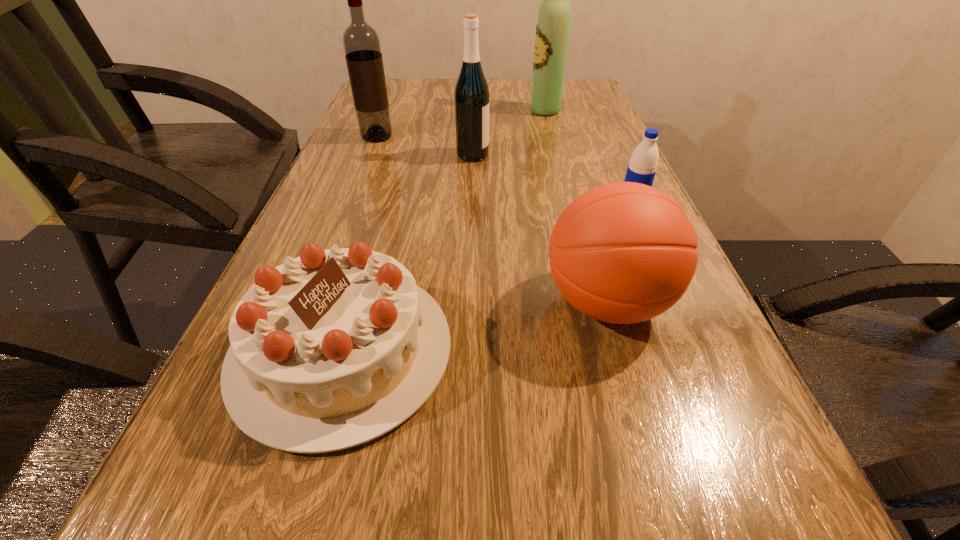
Find the location of a particular element. The image size is (960, 540). the farthest object is located at coordinates (553, 25).

The width and height of the screenshot is (960, 540). Find the location of `the farthest wine bottle`. the farthest wine bottle is located at coordinates (553, 25).

Identify the location of the leftmost wine bottle. (361, 43).

Locate an element on the screen. This screenshot has height=540, width=960. the second farthest object is located at coordinates pos(361,43).

Find the location of a particular element. The width and height of the screenshot is (960, 540). the fourth shortest object is located at coordinates (471, 96).

Locate an element on the screen. the shortest wine bottle is located at coordinates (471, 96).

You are a GUI agent. You are given a task and a screenshot of the screen. Output one action in this format:
    pyautogui.click(x=<x>, y=<y>)
    Task: Click on the basketball
    Image resolution: width=960 pixels, height=540 pixels.
    Given the screenshot: What is the action you would take?
    pyautogui.click(x=624, y=252)

Find the location of a particular element. The image size is (960, 540). water bottle is located at coordinates (x=642, y=167).

What are the coordinates of `birthday cake` in the screenshot? It's located at (332, 349).

This screenshot has height=540, width=960. Find the location of `vacant space located on the front-facing side of the farthest object`. vacant space located on the front-facing side of the farthest object is located at coordinates (488, 111).